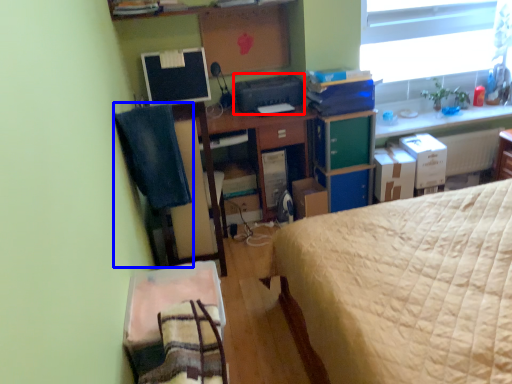
Question: Which of the following is the farthest to the observer, printer (highlighted by a red box) or computer chair (highlighted by a blue box)?

Choices:
 (A) printer
 (B) computer chair

Answer: (A)